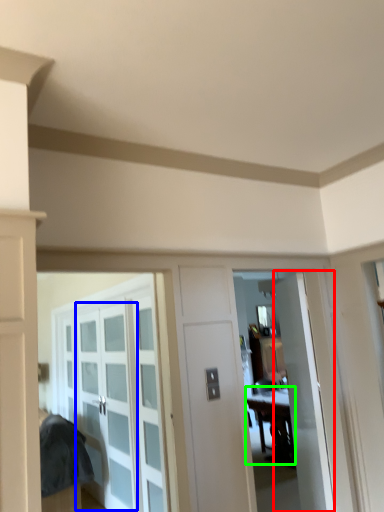
Question: Estimate the real-world distances between objects in this image. Which object is closer to door (highlighted by a red box), glass door (highlighted by a blue box) or table (highlighted by a green box)?

Choices:
 (A) glass door
 (B) table

Answer: (A)